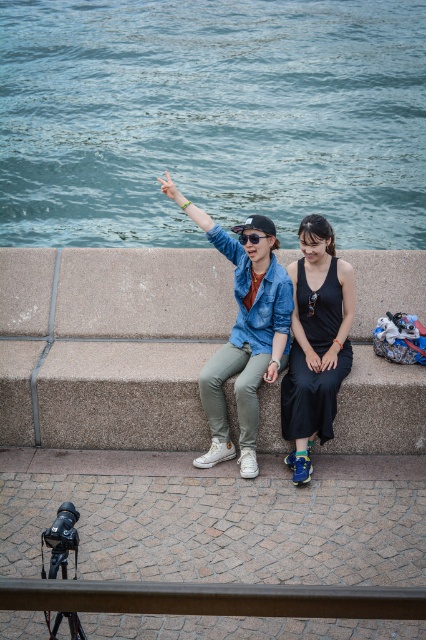
You are a photographer trying to set up a tripod for a shot. You see the concrete ledge at center and the black matte sunglasses at upper center. Which object is taller and can provide a better elevated surface for the tripod?

The concrete ledge at center is much taller than the black matte sunglasses at upper center, so it can provide a better elevated surface for the tripod.

Consider the image. You are a photographer trying to capture the scene with a wide angle lens. The blue water at upper center and the black matte sunglasses at upper center are both in your frame. Which object occupies more horizontal space in the photo?

The blue water at upper center occupies more horizontal space in the photo because its width is larger than that of the black matte sunglasses at upper center.

You are a photographer setting up your equipment. You see the concrete ledge at center and the black matte sunglasses at upper center. Which object is located to the left of the other?

The concrete ledge at center is positioned on the left side of black matte sunglasses at upper center.